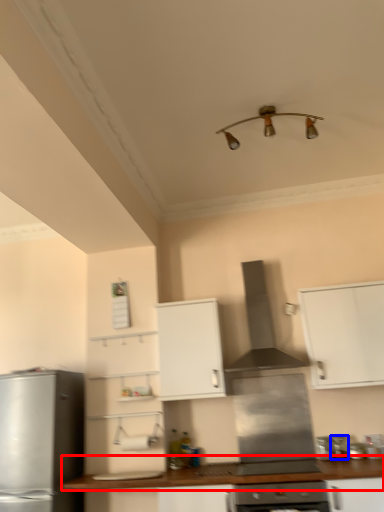
Question: Among these objects, which one is farthest to the camera, countertop (highlighted by a red box) or appliance (highlighted by a blue box)?

Choices:
 (A) countertop
 (B) appliance

Answer: (B)